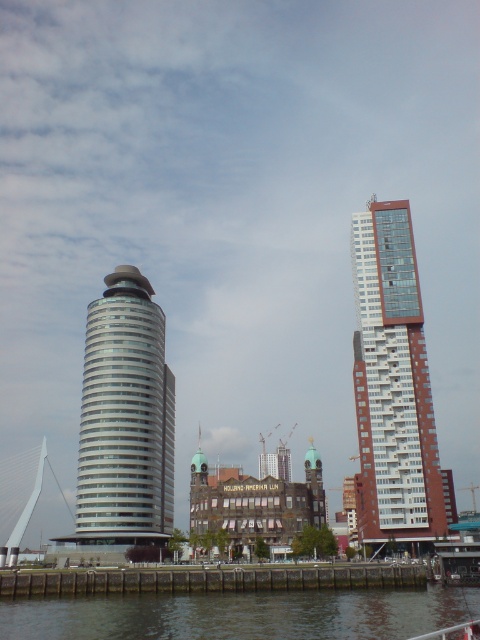
Question: Which object appears farthest from the camera in this image?

Choices:
 (A) smooth concrete wall at lower center
 (B) white glass building at right

Answer: (B)

Question: Does white glossy tower at center appear under smooth concrete wall at lower center?

Choices:
 (A) yes
 (B) no

Answer: (B)

Question: Does white glass building at right appear under smooth concrete wall at lower center?

Choices:
 (A) yes
 (B) no

Answer: (B)

Question: Among these points, which one is farthest from the camera?

Choices:
 (A) (399, 536)
 (B) (107, 355)

Answer: (B)

Question: Which point appears closest to the camera in this image?

Choices:
 (A) (384, 333)
 (B) (136, 365)

Answer: (A)

Question: Is white glass building at right smaller than smooth concrete wall at lower center?

Choices:
 (A) no
 (B) yes

Answer: (A)